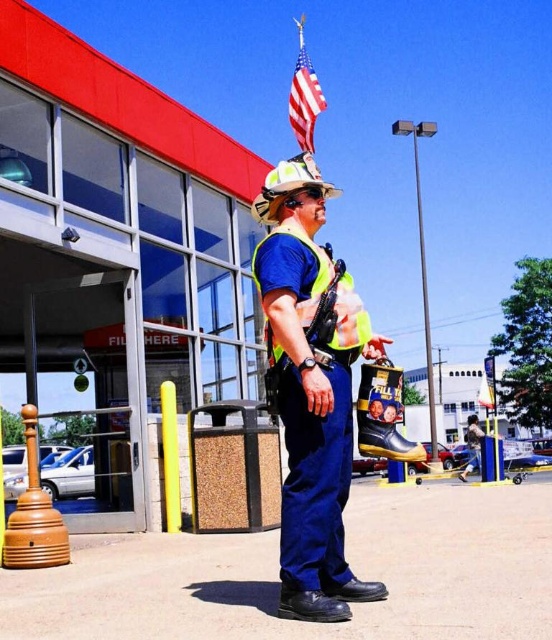
Question: Is the position of blue fabric uniform at center more distant than that of yellow reflective safety vest at center?

Choices:
 (A) yes
 (B) no

Answer: (B)

Question: Where is blue fabric uniform at center located in relation to blue denim jeans at center in the image?

Choices:
 (A) above
 (B) below

Answer: (A)

Question: Does red fabric flag at upper center appear on the right side of blue denim jeans at center?

Choices:
 (A) no
 (B) yes

Answer: (A)

Question: Which object is closer to the camera taking this photo?

Choices:
 (A) blue denim jeans at center
 (B) yellow reflective safety vest at center

Answer: (B)

Question: Which point is closer to the camera?

Choices:
 (A) (294, 456)
 (B) (355, 307)
 (C) (476, 458)

Answer: (A)

Question: Which of these objects is positioned closest to the yellow reflective safety vest at center?

Choices:
 (A) red fabric flag at upper center
 (B) blue denim jeans at center
 (C) blue fabric uniform at center

Answer: (C)